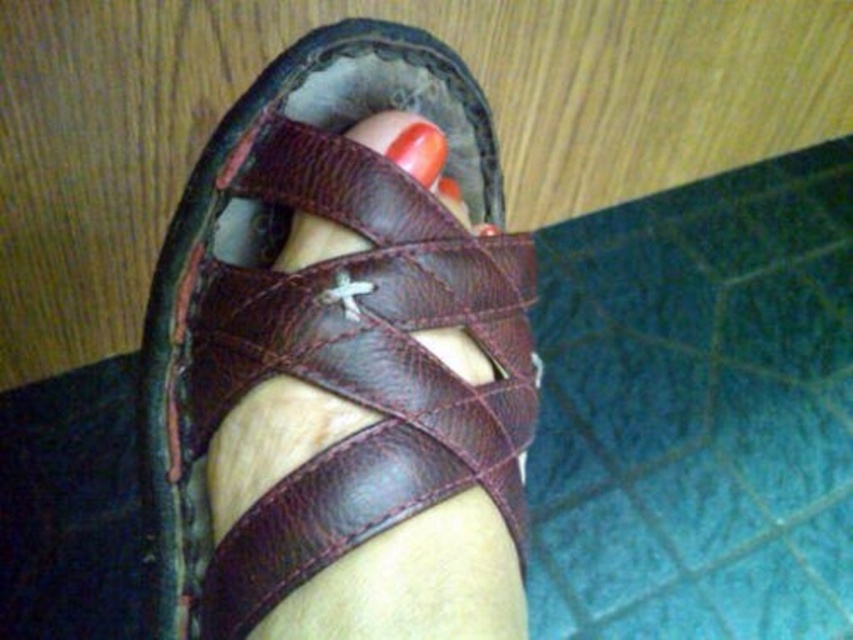
Between brown leather sandal at center and glossy orange nail at center, which one has less height?

glossy orange nail at center is shorter.

Between point (273, 124) and point (431, 164), which one is positioned in front?

Point (431, 164)

Does point (421, 40) come behind point (416, 122)?

Yes.

Identify the location of brown leather sandal at center. The width and height of the screenshot is (853, 640). pyautogui.click(x=341, y=362).